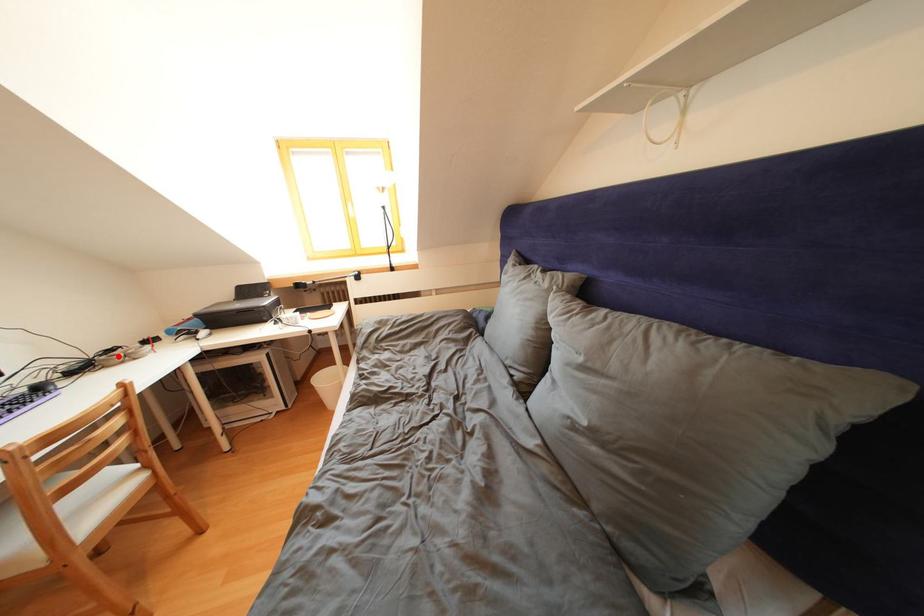
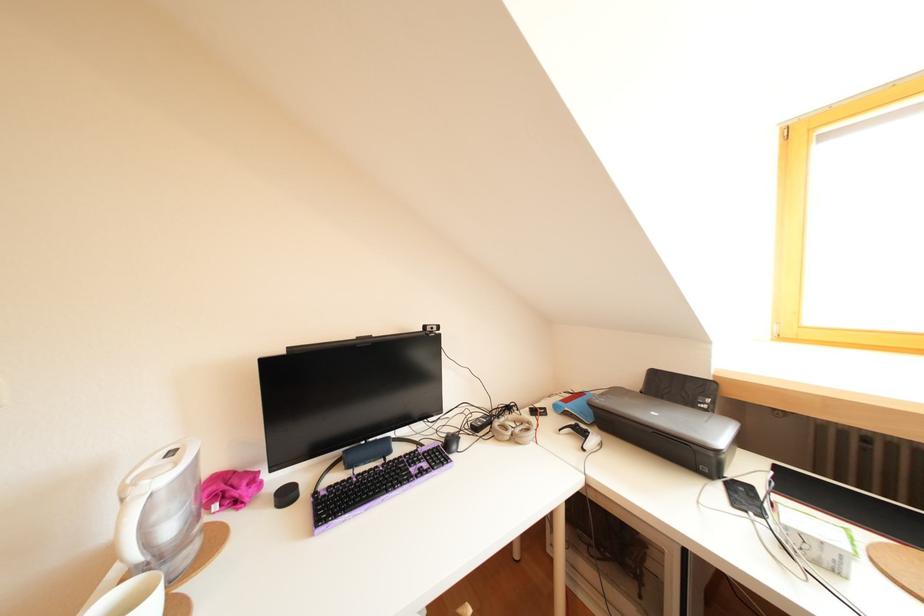
Find the pixel in the second image that matches the highlighted location in the first image.

(516, 413)